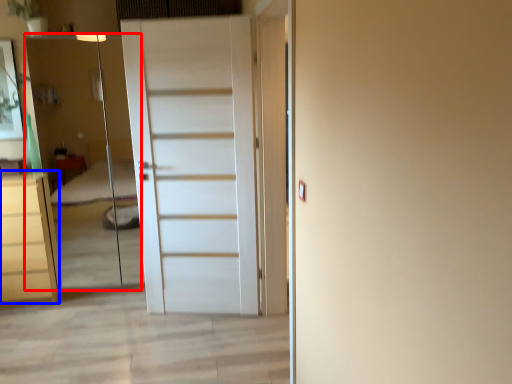
Question: Among these objects, which one is nearest to the camera, elevator (highlighted by a red box) or chest of drawers (highlighted by a blue box)?

Choices:
 (A) elevator
 (B) chest of drawers

Answer: (A)